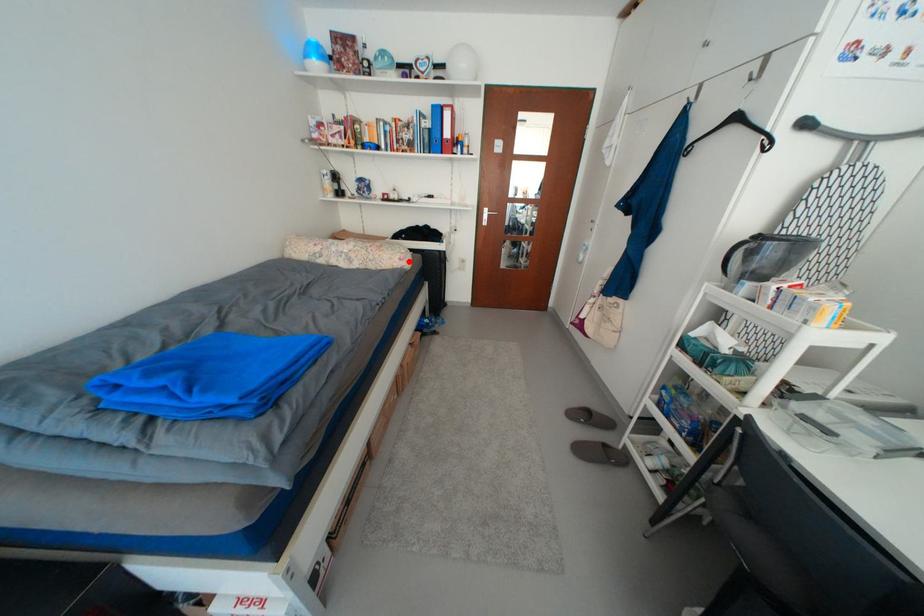
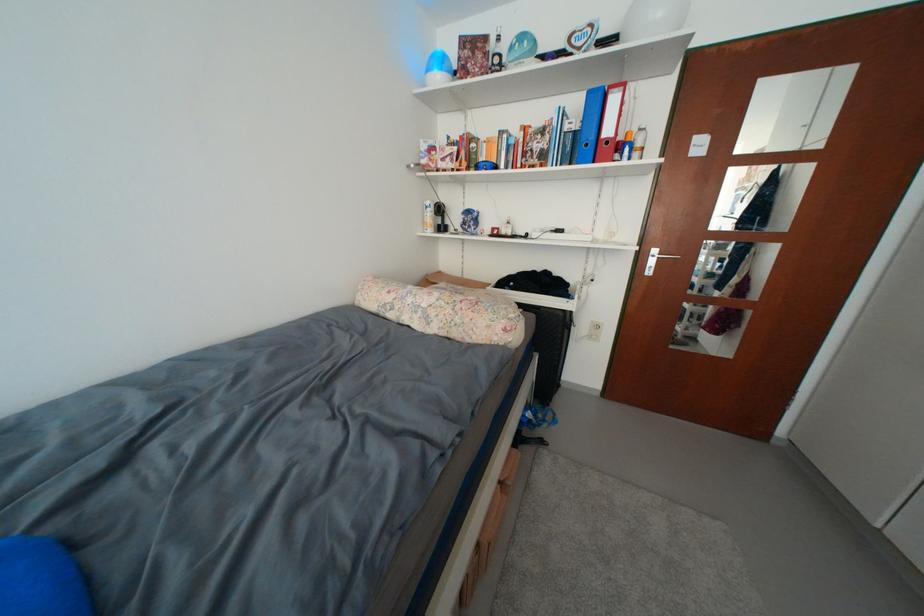
Question: A red point is marked in image1. In image2, is the corresponding 3D point closer to the camera or farther? Reply with the corresponding letter.

Choices:
 (A) The corresponding 3D point is closer.
 (B) The corresponding 3D point is farther.

Answer: (B)